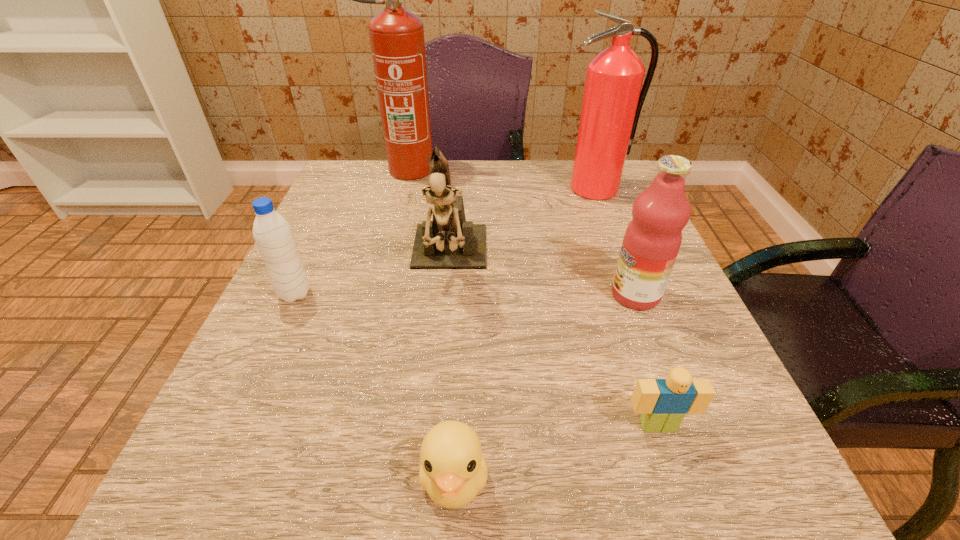
Find the location of `free spot located at the nozzle of the right fire extinguisher`. free spot located at the nozzle of the right fire extinguisher is located at coordinates (606, 213).

At what (x,y) coordinates should I click in order to perform the action: click on vacant space situated on the front-facing side of the figurine. Please return your answer as a coordinate pair (x, y). This screenshot has height=540, width=960. Looking at the image, I should click on (440, 371).

The image size is (960, 540). Identify the location of vacant space located 0.190m on the label of the fruit juice. (505, 295).

I want to click on vacant space situated on the label of the fruit juice, so click(505, 295).

Locate an element on the screen. Image resolution: width=960 pixels, height=540 pixels. free space located 0.270m on the label of the fruit juice is located at coordinates (461, 295).

This screenshot has height=540, width=960. Identify the location of vacant space located 0.360m on the front of the water bottle. (187, 528).

Where is `free space located on the face of the Lego`? free space located on the face of the Lego is located at coordinates (676, 480).

At what (x,y) coordinates should I click in order to perform the action: click on object that is positioned at the near edge. Please return your answer as a coordinate pair (x, y). This screenshot has height=540, width=960. Looking at the image, I should click on (453, 470).

In order to click on fire extinguisher that is at the left edge in this screenshot , I will do `click(397, 41)`.

At what (x,y) coordinates should I click in order to perform the action: click on water bottle that is positioned at the left edge. Please return your answer as a coordinate pair (x, y). Looking at the image, I should click on (273, 235).